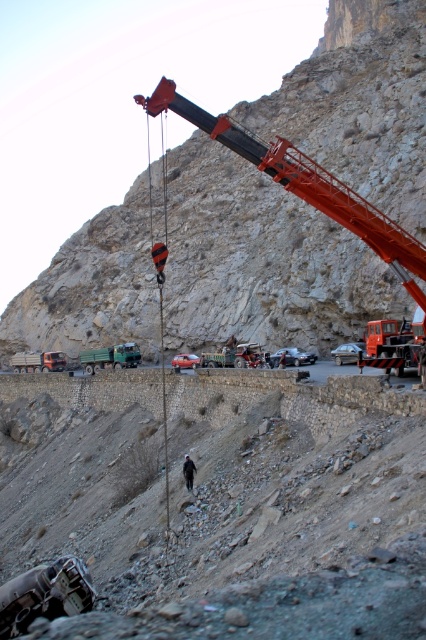
Question: Is rusty metal crane arm at upper center above rough stone hillside at upper center?

Choices:
 (A) yes
 (B) no

Answer: (B)

Question: Can you confirm if metallic silver sedan at center is positioned to the right of metallic silver car at center?

Choices:
 (A) yes
 (B) no

Answer: (A)

Question: Which object appears farthest from the camera in this image?

Choices:
 (A) shiny silver sedan at center
 (B) metallic silver car at center
 (C) dark gray fabric construction worker at center

Answer: (B)

Question: Which of the following is the farthest from the observer?

Choices:
 (A) click(x=198, y=356)
 (B) click(x=189, y=465)
 (C) click(x=354, y=356)

Answer: (A)

Question: Can you confirm if shiny silver sedan at center is thinner than metallic silver car at center?

Choices:
 (A) yes
 (B) no

Answer: (B)

Question: Which object is positioned closest to the metallic silver car at center?

Choices:
 (A) shiny silver sedan at center
 (B) rusty metal crane arm at upper center

Answer: (A)